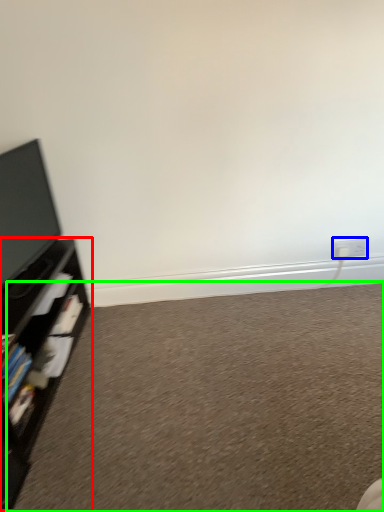
Question: Considering the real-world distances, which object is closest to shelf (highlighted by a red box)? electric outlet (highlighted by a blue box) or plain (highlighted by a green box).

Choices:
 (A) electric outlet
 (B) plain

Answer: (B)